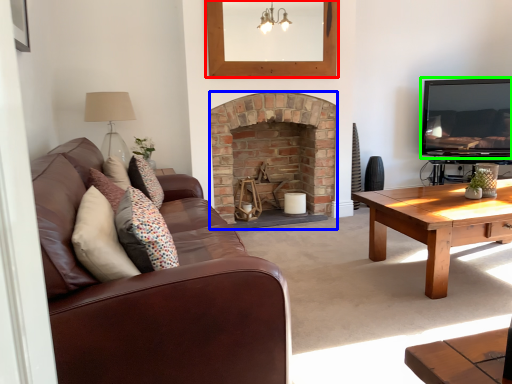
Question: Estimate the real-world distances between objects in this image. Which object is farther from picture frame (highlighted by a red box), fireplace (highlighted by a blue box) or television (highlighted by a green box)?

Choices:
 (A) fireplace
 (B) television

Answer: (B)